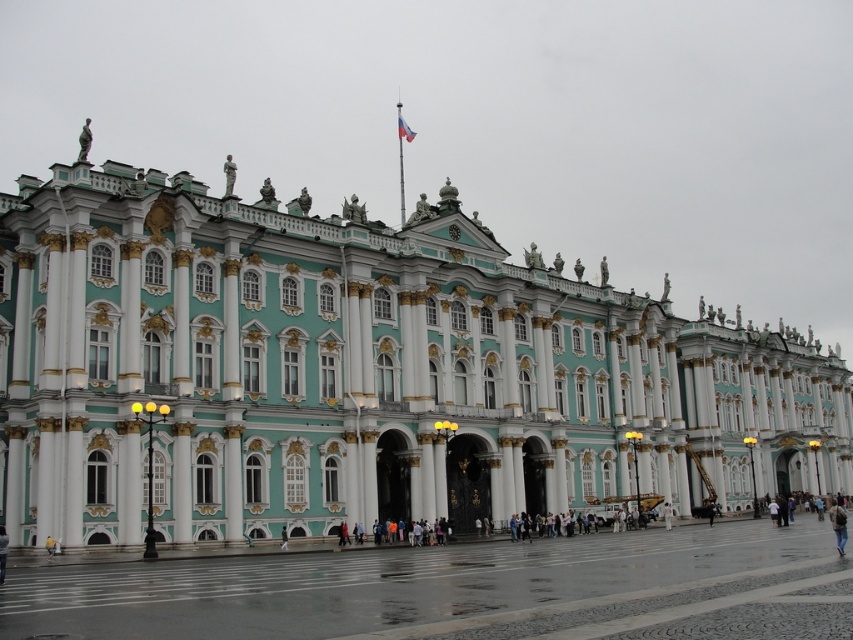
Question: Is teal/golden stone building at center bigger than polished stone plaza at center?

Choices:
 (A) no
 (B) yes

Answer: (B)

Question: Is the position of teal/golden stone building at center more distant than that of polished stone plaza at center?

Choices:
 (A) yes
 (B) no

Answer: (A)

Question: Which point is farther from the camera taking this photo?

Choices:
 (A) (845, 426)
 (B) (28, 616)

Answer: (A)

Question: Which point appears farthest from the camera in this image?

Choices:
 (A) (207, 376)
 (B) (335, 616)

Answer: (A)

Question: Is teal/golden stone building at center to the left of polished stone plaza at center from the viewer's perspective?

Choices:
 (A) no
 (B) yes

Answer: (B)